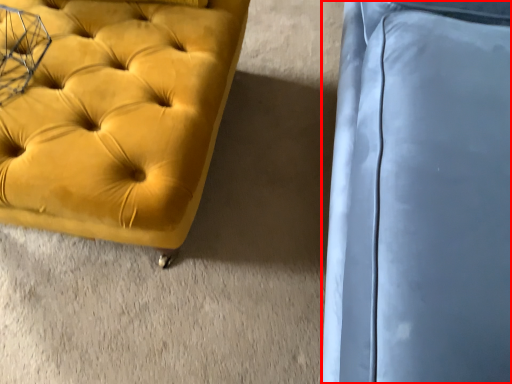
Question: From the image, what is the correct spatial relationship of swivel chair (annotated by the red box) in relation to furniture?

Choices:
 (A) left
 (B) right

Answer: (B)